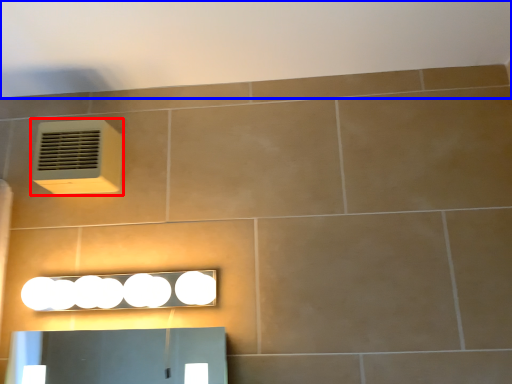
Question: Which of the following is the farthest to the observer, air conditioning (highlighted by a red box) or backdrop (highlighted by a blue box)?

Choices:
 (A) air conditioning
 (B) backdrop

Answer: (A)